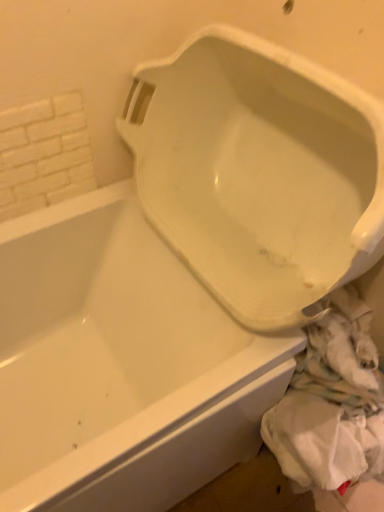
Question: Is white brick wall at upper left not near white fabric at lower right?

Choices:
 (A) yes
 (B) no

Answer: (B)

Question: Is white brick wall at upper left outside white fabric at lower right?

Choices:
 (A) yes
 (B) no

Answer: (A)

Question: Is white brick wall at upper left behind white fabric at lower right?

Choices:
 (A) no
 (B) yes

Answer: (A)

Question: Does white brick wall at upper left lie in front of white fabric at lower right?

Choices:
 (A) no
 (B) yes

Answer: (B)

Question: Is white brick wall at upper left thinner than white fabric at lower right?

Choices:
 (A) yes
 (B) no

Answer: (A)

Question: Does point (329, 354) appear closer or farther from the camera than point (82, 140)?

Choices:
 (A) closer
 (B) farther

Answer: (A)

Question: From a real-world perspective, is white fabric at lower right physically located above or below white brick wall at upper left?

Choices:
 (A) below
 (B) above

Answer: (A)

Question: Is white fabric at lower right taller or shorter than white brick wall at upper left?

Choices:
 (A) tall
 (B) short

Answer: (B)

Question: From the image's perspective, is white fabric at lower right located above or below white brick wall at upper left?

Choices:
 (A) below
 (B) above

Answer: (A)

Question: Is white brick wall at upper left in front of or behind white glossy urinal at center in the image?

Choices:
 (A) behind
 (B) front

Answer: (A)

Question: Is point (59, 126) positioned closer to the camera than point (167, 137)?

Choices:
 (A) farther
 (B) closer

Answer: (B)

Question: From a real-world perspective, is white brick wall at upper left physically located above or below white glossy urinal at center?

Choices:
 (A) above
 (B) below

Answer: (A)

Question: Considering the positions of white brick wall at upper left and white glossy urinal at center in the image, is white brick wall at upper left taller or shorter than white glossy urinal at center?

Choices:
 (A) short
 (B) tall

Answer: (A)

Question: Which is correct: white glossy urinal at center is inside white brick wall at upper left, or outside of it?

Choices:
 (A) outside
 (B) inside

Answer: (A)

Question: From a real-world perspective, relative to white brick wall at upper left, is white glossy urinal at center vertically above or below?

Choices:
 (A) above
 (B) below

Answer: (B)